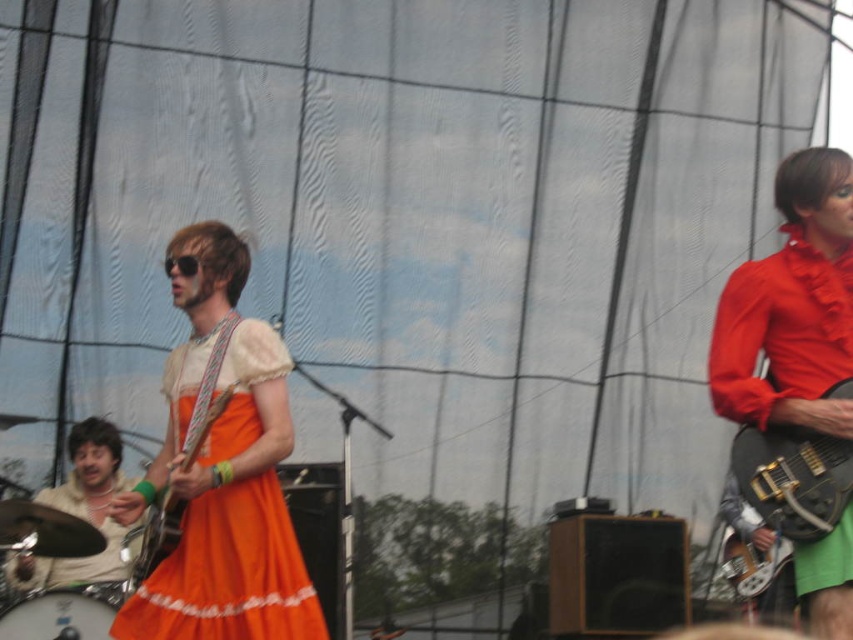
Question: Which object is positioned closest to the white drum head at lower left?

Choices:
 (A) matte red blouse at right
 (B) orange satin dress at center
 (C) beige fabric drum set at lower left
 (D) black glossy electric guitar at right

Answer: (B)

Question: Is matte red blouse at right bigger than black glossy electric guitar at right?

Choices:
 (A) no
 (B) yes

Answer: (B)

Question: Which of the following is the closest to the observer?

Choices:
 (A) black glossy electric guitar at right
 (B) beige fabric drum set at lower left
 (C) white drum head at lower left

Answer: (A)

Question: Is black glossy electric guitar at right further to the viewer compared to white drum head at lower left?

Choices:
 (A) no
 (B) yes

Answer: (A)

Question: Among these objects, which one is nearest to the camera?

Choices:
 (A) beige fabric drum set at lower left
 (B) matte red blouse at right
 (C) black glossy electric guitar at right

Answer: (C)

Question: Is orange satin dress at center smaller than black glossy electric guitar at right?

Choices:
 (A) no
 (B) yes

Answer: (A)